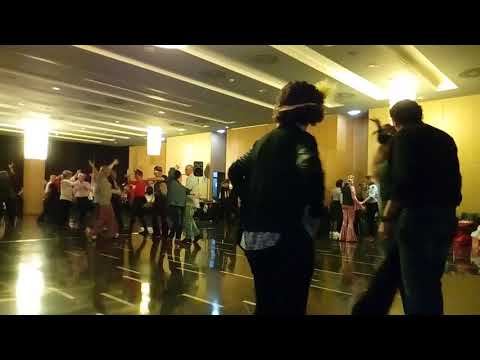
What are the coordinates of `bright light reflection on floor` in the screenshot? It's located at (28, 277).